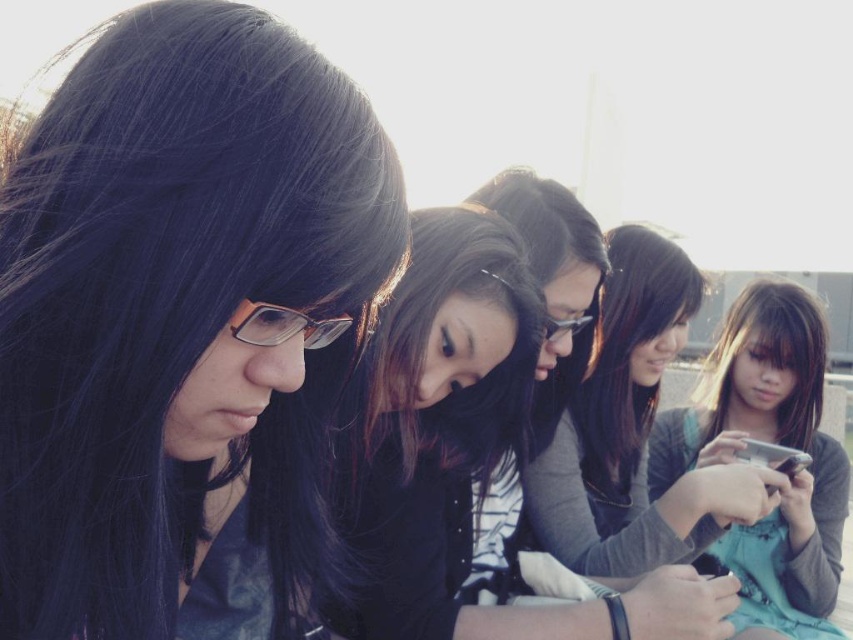
Question: Does dark brown silky hair at center have a lesser width compared to matte silver phone at lower right?

Choices:
 (A) yes
 (B) no

Answer: (B)

Question: Which point appears closest to the camera in this image?

Choices:
 (A) (808, 458)
 (B) (602, 465)
 (C) (354, 612)
 (D) (645, 232)

Answer: (C)

Question: Which point is farther from the camera taking this photo?

Choices:
 (A) (793, 298)
 (B) (178, 593)

Answer: (A)

Question: Which point is closer to the camera?

Choices:
 (A) (572, 621)
 (B) (814, 426)

Answer: (A)

Question: Can you confirm if smooth black hair at center is wider than dark brown silky hair at lower right?

Choices:
 (A) no
 (B) yes

Answer: (B)

Question: Can you confirm if smooth black hair at center is positioned to the left of gray fabric shirt at center?

Choices:
 (A) yes
 (B) no

Answer: (A)